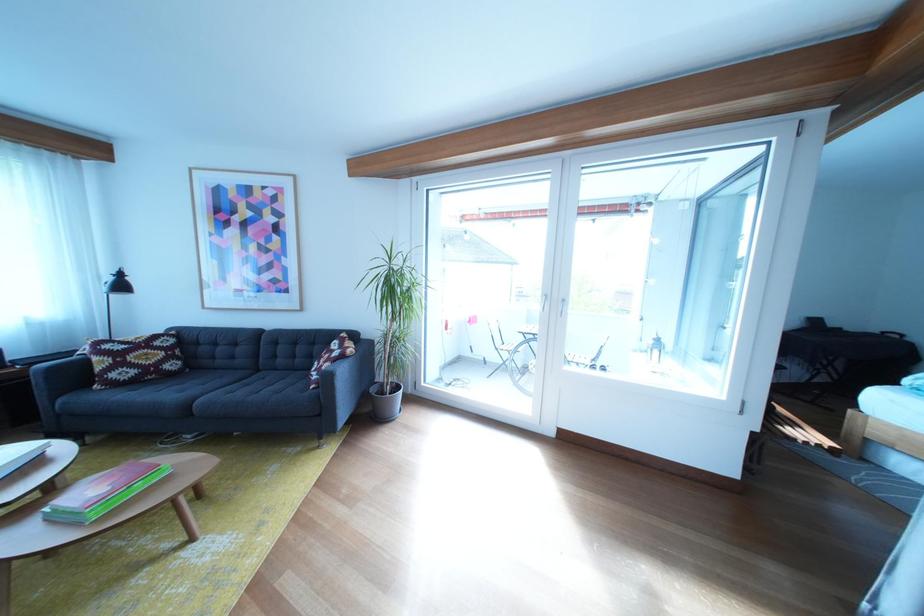
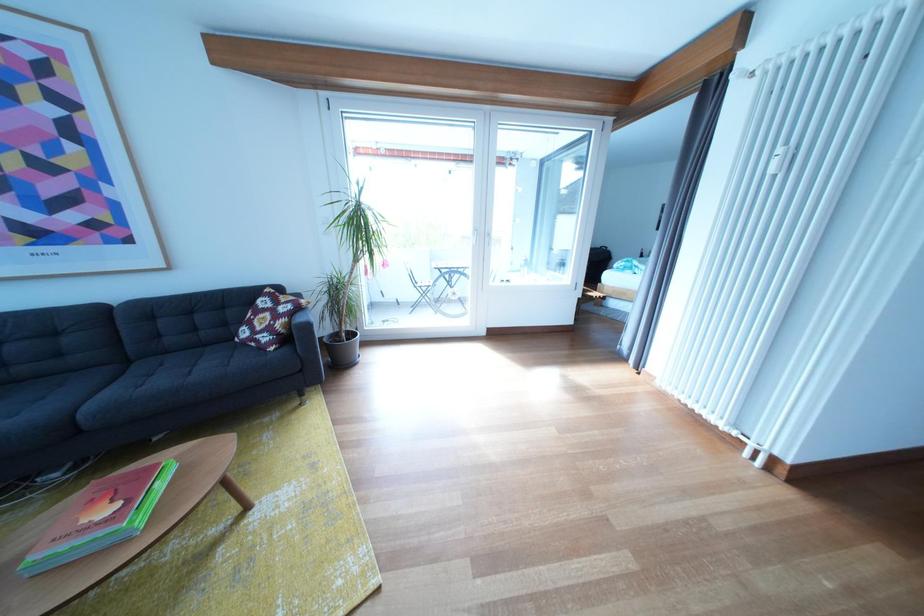
Find the pixel in the second image that matches [355,338] in the first image.

(276, 293)